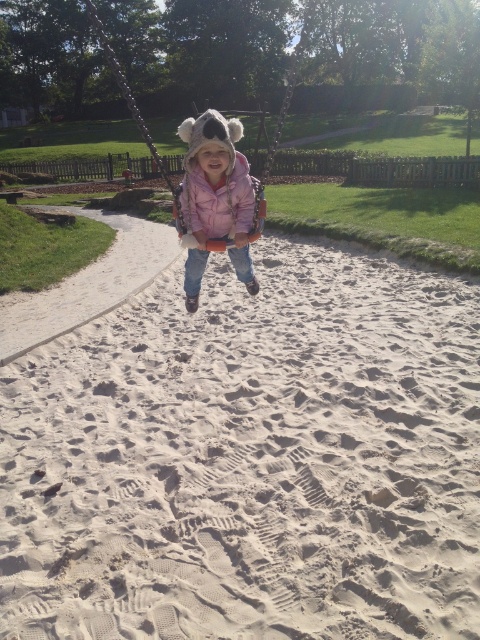
Question: Among these objects, which one is farthest from the camera?

Choices:
 (A) smooth sand at center
 (B) fuzzy pink swing at center
 (C) pink fleece jacket at center

Answer: (B)

Question: Which point is closer to the camera?

Choices:
 (A) pink fleece jacket at center
 (B) smooth sand at center
 (C) fuzzy pink swing at center

Answer: (B)

Question: From the image, what is the correct spatial relationship of smooth sand at center in relation to pink fleece jacket at center?

Choices:
 (A) below
 (B) above

Answer: (A)

Question: Does pink fleece jacket at center appear on the right side of fuzzy pink swing at center?

Choices:
 (A) no
 (B) yes

Answer: (B)

Question: Does pink fleece jacket at center lie in front of fuzzy pink swing at center?

Choices:
 (A) no
 (B) yes

Answer: (B)

Question: Which point is closer to the camera?

Choices:
 (A) (192, 230)
 (B) (242, 189)
 (C) (145, 138)
 (D) (408, 544)

Answer: (D)